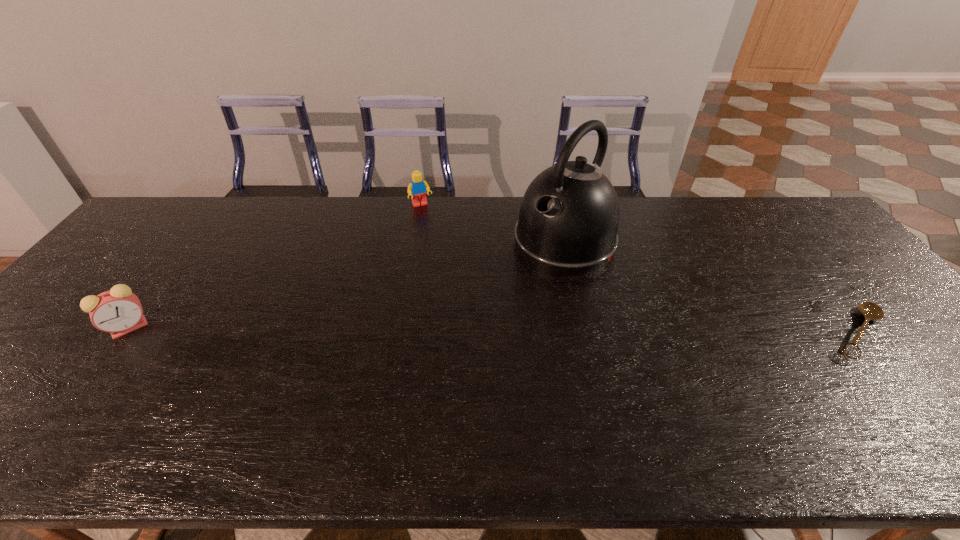
Image resolution: width=960 pixels, height=540 pixels. I want to click on free space on the desktop that is between the leftmost object and the shortest object and is positioned on the spout of the kettle, so click(x=469, y=330).

Find the location of a particular element. The image size is (960, 540). vacant spot on the desktop that is between the leftmost object and the shortest object and is positioned on the front-facing side of the third object from right to left is located at coordinates (485, 330).